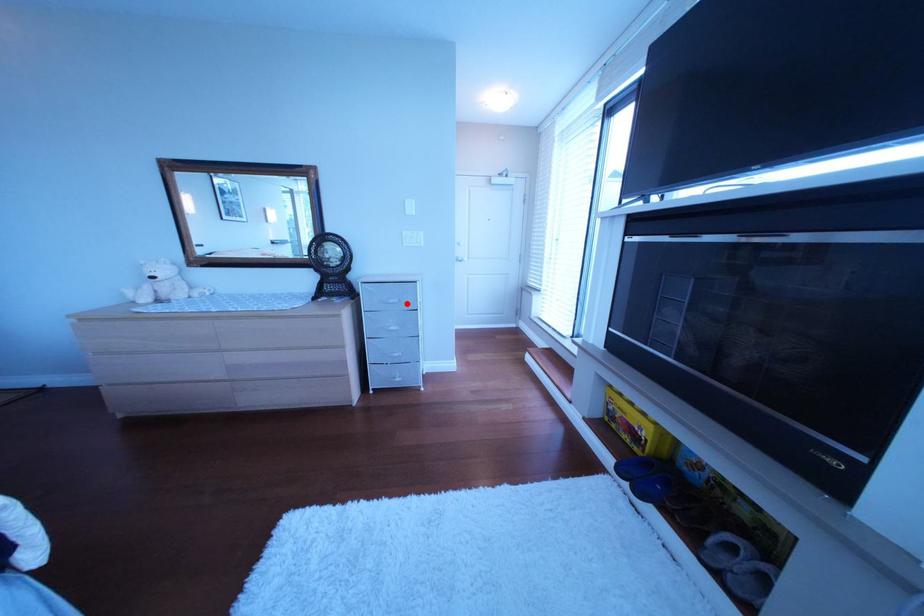
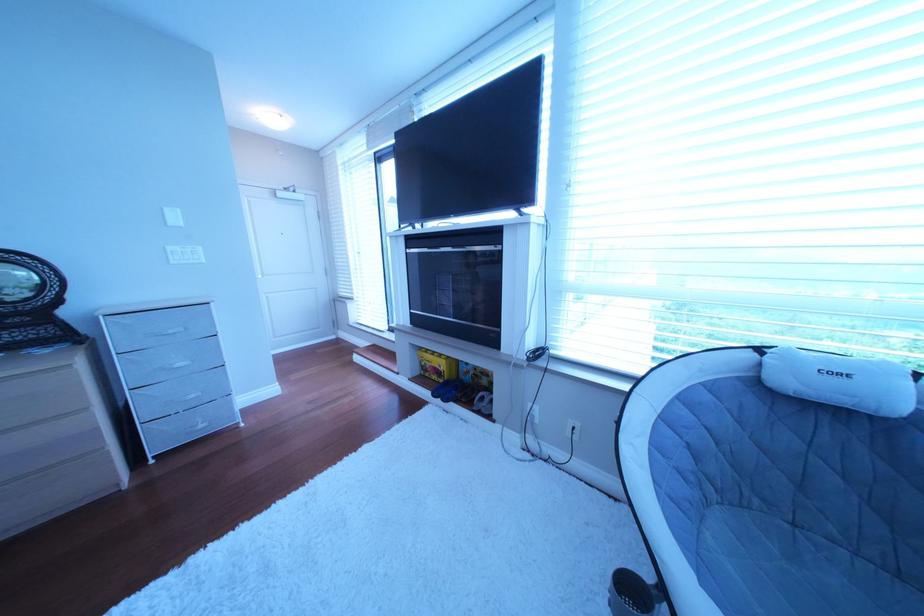
Find the pixel in the second image that matches the highlighted location in the first image.

(188, 334)